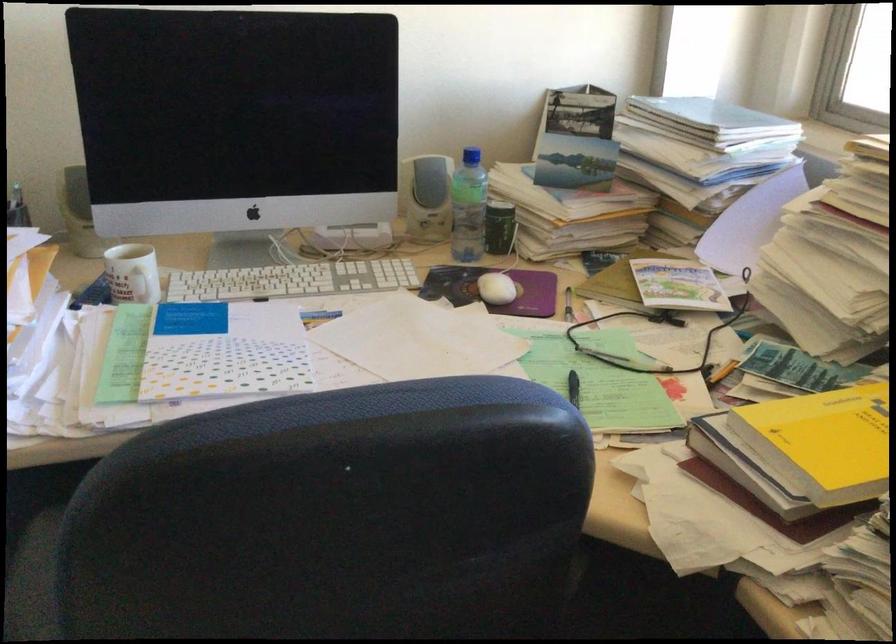
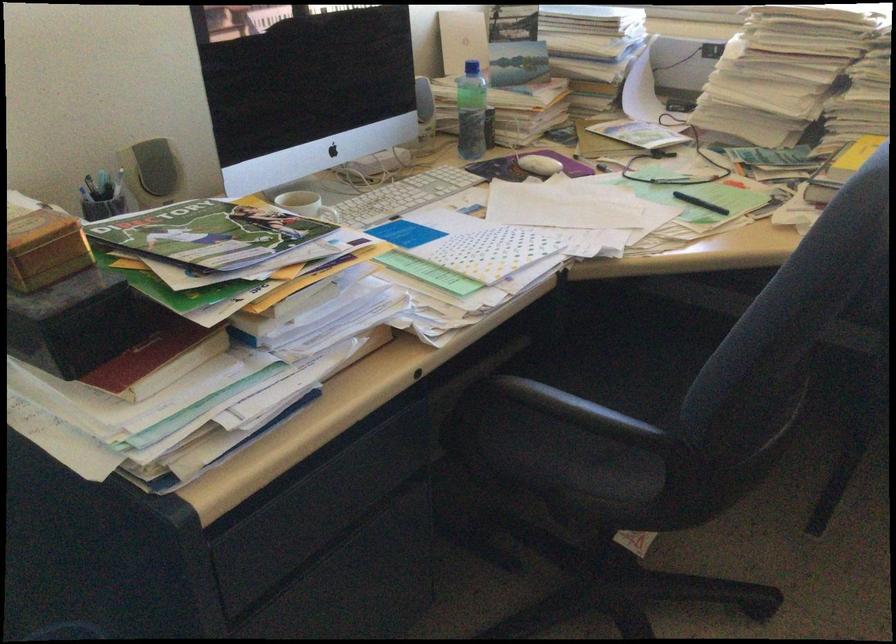
Find the pixel in the second image that matches point (213, 281) in the first image.

(334, 216)